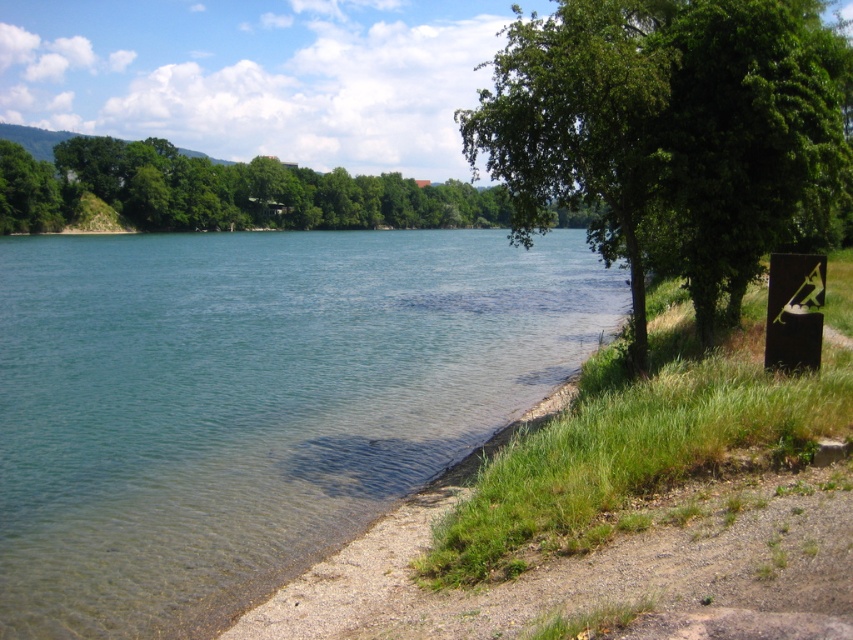
Which of these two, clear water at shore left or green leafy tree at center, stands shorter?

With less height is clear water at shore left.

Does clear water at shore left appear under green leafy tree at center?

Yes, clear water at shore left is below green leafy tree at center.

This screenshot has height=640, width=853. What are the coordinates of `clear water at shore left` in the screenshot? It's located at (251, 401).

Who is higher up, clear water at shore left or green leafy tree at upper left?

green leafy tree at upper left is higher up.

Is point (0, 284) positioned before point (137, 154)?

Yes, it is in front of point (137, 154).

Does point (41, 272) come behind point (100, 140)?

No, (41, 272) is in front of (100, 140).

Locate an element on the screen. This screenshot has height=640, width=853. clear water at shore left is located at coordinates (251, 401).

Is point (601, 109) less distant than point (474, 221)?

Yes, point (601, 109) is closer to viewer.

Can you confirm if green leafy tree at center is positioned below green leafy tree at upper left?

Incorrect, green leafy tree at center is not positioned below green leafy tree at upper left.

In order to click on green leafy tree at center in this screenshot , I will do `click(668, 134)`.